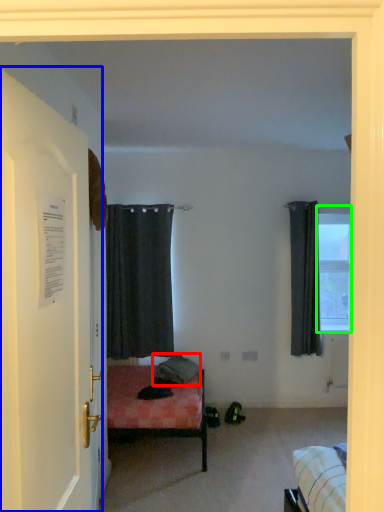
Question: Considering the real-world distances, which object is closest to pillow (highlighted by a red box)? door (highlighted by a blue box) or window (highlighted by a green box).

Choices:
 (A) door
 (B) window

Answer: (B)